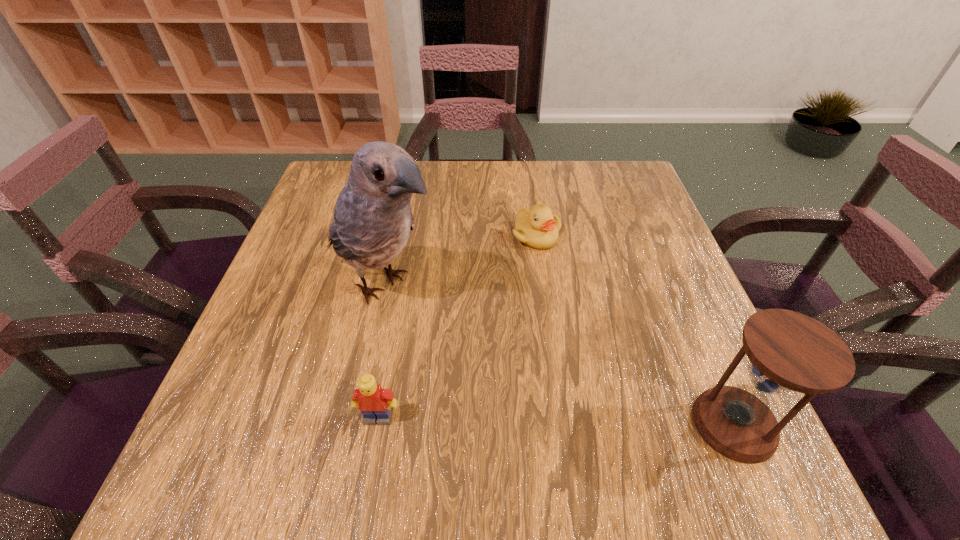
Find the location of `free space located 0.320m on the front-facing side of the duckling`. free space located 0.320m on the front-facing side of the duckling is located at coordinates (555, 367).

Locate an element on the screen. This screenshot has width=960, height=540. blank space located on the front-facing side of the parrot is located at coordinates (457, 326).

This screenshot has height=540, width=960. Identify the location of free space located on the front-facing side of the parrot. (485, 343).

Locate an element on the screen. The height and width of the screenshot is (540, 960). vacant space located 0.060m on the front-facing side of the parrot is located at coordinates (449, 321).

Identify the location of Lego present at the near edge. The height and width of the screenshot is (540, 960). (374, 402).

Identify the location of hourglass present at the near edge. (787, 350).

The height and width of the screenshot is (540, 960). I want to click on object located at the left edge, so click(x=372, y=222).

Where is `object present at the right edge`? object present at the right edge is located at coordinates (787, 350).

Where is `object that is at the near right corner`? The width and height of the screenshot is (960, 540). object that is at the near right corner is located at coordinates (787, 350).

Image resolution: width=960 pixels, height=540 pixels. I want to click on vacant space at the far edge of the desktop, so click(x=469, y=193).